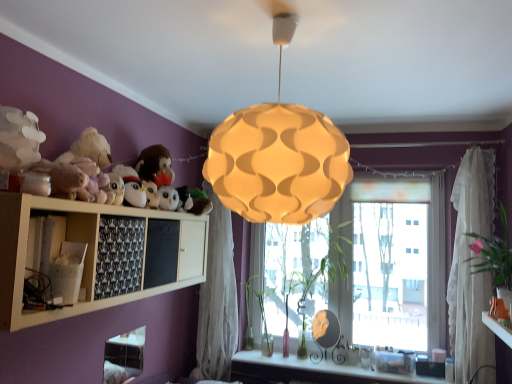
Locate an element on the screen. This screenshot has height=384, width=512. free space above matte yellow pendant light at center (from a real-world perspective) is located at coordinates (271, 22).